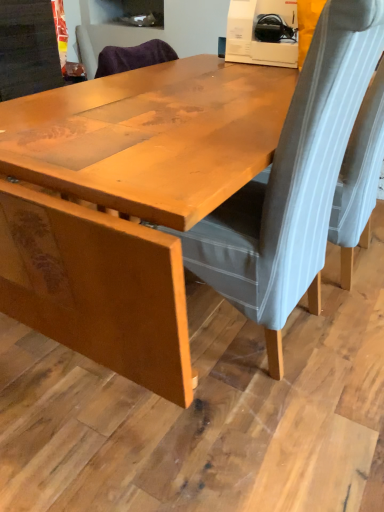
Question: Is velvet grey chair at center, the 1th chair in the left-to-right sequence, spatially inside gray fabric chair at right, the 1th chair when ordered from right to left, or outside of it?

Choices:
 (A) inside
 (B) outside

Answer: (B)

Question: Visually, is velvet grey chair at center, the second chair in the right-to-left sequence, positioned to the left or to the right of gray fabric chair at right, the 1th chair when ordered from right to left?

Choices:
 (A) right
 (B) left

Answer: (B)

Question: Which of these objects is positioned closest to the gray fabric chair at right, the 1th chair when ordered from right to left?

Choices:
 (A) velvet grey chair at center, the 1th chair in the left-to-right sequence
 (B) wooden table at center

Answer: (A)

Question: Which is farther from the gray fabric chair at right, the second chair when ordered from left to right?

Choices:
 (A) wooden table at center
 (B) velvet grey chair at center, the second chair in the right-to-left sequence

Answer: (A)